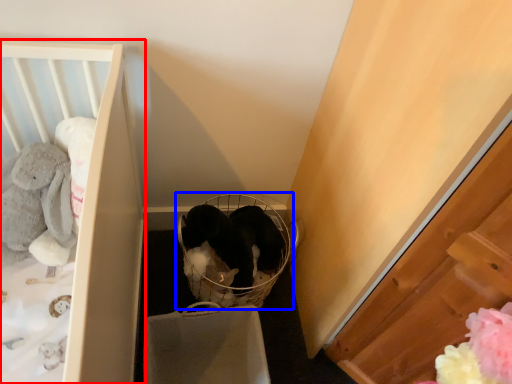
Question: Which object appears closest to the camera in this image, furniture (highlighted by a red box) or baby carriage (highlighted by a blue box)?

Choices:
 (A) furniture
 (B) baby carriage

Answer: (A)